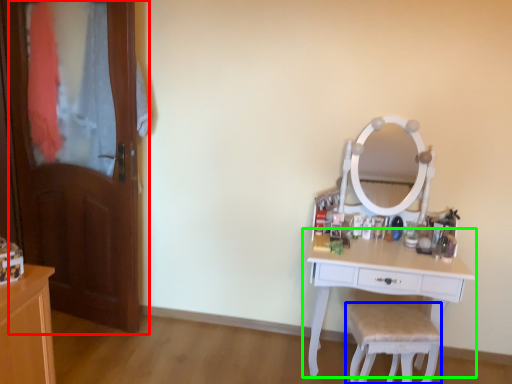
Question: Considering the real-world distances, which object is closest to door (highlighted by a red box)? chair (highlighted by a blue box) or table (highlighted by a green box).

Choices:
 (A) chair
 (B) table

Answer: (B)